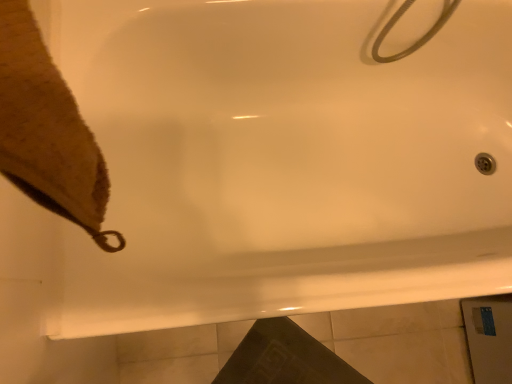
Describe the element at coordinates (47, 131) in the screenshot. The image size is (512, 384). I see `brown textured towel at left` at that location.

At what (x,y) coordinates should I click in order to perform the action: click on brown textured towel at left. Please return your answer as a coordinate pair (x, y). The height and width of the screenshot is (384, 512). Looking at the image, I should click on (47, 131).

Find the location of `brown textured towel at left`. brown textured towel at left is located at coordinates (47, 131).